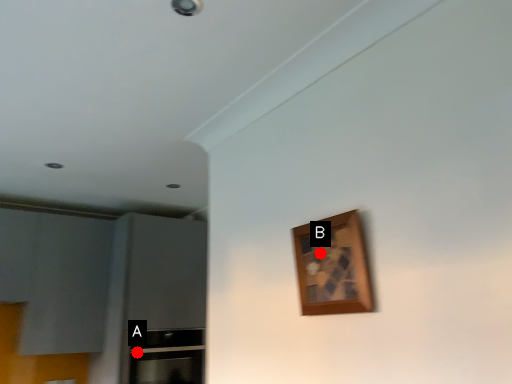
Question: Two points are circled on the image, labeled by A and B beside each circle. Which of the following is the farthest from the observer?

Choices:
 (A) A is further
 (B) B is further

Answer: (A)